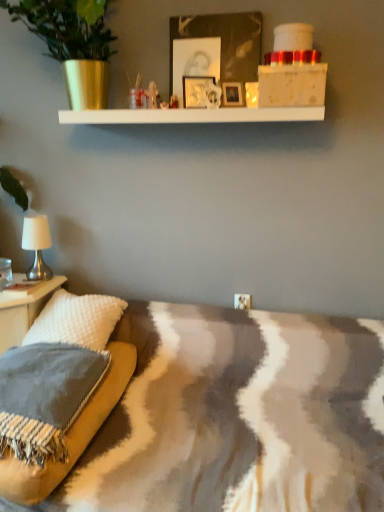
Describe the element at coordinates (45, 396) in the screenshot. I see `textured gray pillow at lower left` at that location.

Find the location of a particular element. white fabric lampshade at left is located at coordinates (37, 245).

The image size is (384, 512). Identify the location of textured gray pillow at lower left. (45, 396).

Is textured gray pillow at lower left positioned beyond the bounds of white fabric lampshade at left?

Yes, textured gray pillow at lower left is not within white fabric lampshade at left.

Find the location of a particular element. The height and width of the screenshot is (512, 384). pillow to the right of white fabric lampshade at left is located at coordinates (45, 396).

Between textured gray pillow at lower left and white fabric lampshade at left, which one has larger size?

With larger size is textured gray pillow at lower left.

From the image's perspective, which is below, textured gray pillow at lower left or white fabric lampshade at left?

textured gray pillow at lower left.

Considering the positions of objects metallic silver picture frame at upper center and textured gray pillow at lower left in the image provided, who is more to the left, metallic silver picture frame at upper center or textured gray pillow at lower left?

textured gray pillow at lower left.

This screenshot has height=512, width=384. In order to click on pillow that appears below the metallic silver picture frame at upper center (from a real-world perspective) in this screenshot , I will do [x=45, y=396].

In terms of width, does metallic silver picture frame at upper center look wider or thinner when compared to textured gray pillow at lower left?

In the image, metallic silver picture frame at upper center appears to be more narrow than textured gray pillow at lower left.

Is there a large distance between white textured pillow at left and textured gray pillow at lower left?

No, white textured pillow at left is in close proximity to textured gray pillow at lower left.

From a real-world perspective, is white textured pillow at left over textured gray pillow at lower left?

Yes, from a real-world perspective, white textured pillow at left is on top of textured gray pillow at lower left.

Does white textured pillow at left come in front of textured gray pillow at lower left?

No, the depth of white textured pillow at left is greater than that of textured gray pillow at lower left.

From the image's perspective, relative to textured gray pillow at lower left, is white textured pillow at left above or below?

Based on their image positions, white textured pillow at left is located above textured gray pillow at lower left.

Considering the positions of objects metallic silver picture frame at upper center and white fabric lampshade at left in the image provided, who is more to the right, metallic silver picture frame at upper center or white fabric lampshade at left?

From the viewer's perspective, metallic silver picture frame at upper center appears more on the right side.

Can you confirm if metallic silver picture frame at upper center is wider than white fabric lampshade at left?

In fact, metallic silver picture frame at upper center might be narrower than white fabric lampshade at left.

Considering the sizes of objects metallic silver picture frame at upper center and white fabric lampshade at left in the image provided, who is shorter, metallic silver picture frame at upper center or white fabric lampshade at left?

metallic silver picture frame at upper center is shorter.

Is textured gray pillow at lower left in front of or behind white textured pillow at left in the image?

Clearly, textured gray pillow at lower left is in front of white textured pillow at left.

Identify the location of throw pillow that is above the textured gray pillow at lower left (from the image's perspective). This screenshot has height=512, width=384. (77, 320).

From the image's perspective, which one is positioned lower, textured gray pillow at lower left or white textured pillow at left?

textured gray pillow at lower left is shown below in the image.

Could you tell me if textured gray pillow at lower left is facing white textured pillow at left?

No.

From a real-world perspective, who is located lower, white fabric lampshade at left or metallic silver picture frame at upper center?

white fabric lampshade at left.

Considering the relative positions of white fabric lampshade at left and metallic silver picture frame at upper center in the image provided, is white fabric lampshade at left to the left or to the right of metallic silver picture frame at upper center?

Clearly, white fabric lampshade at left is on the left of metallic silver picture frame at upper center in the image.

Is metallic silver picture frame at upper center at the back of white fabric lampshade at left?

No.

In the scene shown: Considering the sizes of objects white fabric lampshade at left and metallic silver picture frame at upper center in the image provided, who is bigger, white fabric lampshade at left or metallic silver picture frame at upper center?

Bigger between the two is white fabric lampshade at left.

From the image's perspective, is textured gray pillow at lower left over metallic silver picture frame at upper center?

Actually, textured gray pillow at lower left appears below metallic silver picture frame at upper center in the image.

Is the surface of textured gray pillow at lower left in direct contact with metallic silver picture frame at upper center?

No, textured gray pillow at lower left is not touching metallic silver picture frame at upper center.

Choose the correct answer: Is textured gray pillow at lower left inside metallic silver picture frame at upper center or outside it?

textured gray pillow at lower left is not inside metallic silver picture frame at upper center, it's outside.

Relative to metallic silver picture frame at upper center, is textured gray pillow at lower left in front or behind?

textured gray pillow at lower left is in front of metallic silver picture frame at upper center.

I want to click on pillow that is in front of the white fabric lampshade at left, so click(x=45, y=396).

Find the location of a particular element. picture frame above the textured gray pillow at lower left (from a real-world perspective) is located at coordinates (198, 91).

Looking at the image, which one is located closer to textured gray pillow at lower left, metallic silver picture frame at upper center or white fabric lampshade at left?

white fabric lampshade at left.

Considering their positions, is metallic silver picture frame at upper center positioned closer to white fabric lampshade at left than white textured pillow at left?

white textured pillow at left.

Considering their positions, is white textured pillow at left positioned closer to white fabric lampshade at left than metallic silver picture frame at upper center?

The object closer to white fabric lampshade at left is white textured pillow at left.

Based on their spatial positions, is white textured pillow at left or textured gray pillow at lower left closer to metallic silver picture frame at upper center?

Among the two, white textured pillow at left is located nearer to metallic silver picture frame at upper center.

From the image, which object appears to be nearer to white textured pillow at left, white fabric lampshade at left or textured gray pillow at lower left?

textured gray pillow at lower left lies closer to white textured pillow at left than the other object.

Considering their positions, is textured gray pillow at lower left positioned further to white textured pillow at left than metallic silver picture frame at upper center?

metallic silver picture frame at upper center is further to white textured pillow at left.

Looking at the image, which one is located further to metallic silver picture frame at upper center, white fabric lampshade at left or white textured pillow at left?

white textured pillow at left lies further to metallic silver picture frame at upper center than the other object.

When comparing their distances from textured gray pillow at lower left, does metallic silver picture frame at upper center or white textured pillow at left seem further?

metallic silver picture frame at upper center is further to textured gray pillow at lower left.

The height and width of the screenshot is (512, 384). Identify the location of throw pillow between metallic silver picture frame at upper center and textured gray pillow at lower left vertically. (77, 320).

You are a GUI agent. You are given a task and a screenshot of the screen. Output one action in this format:
    pyautogui.click(x=<x>, y=<y>)
    Task: Click on the table lamp between metallic silver picture frame at upper center and white textured pillow at left from top to bottom
    
    Given the screenshot: What is the action you would take?
    pyautogui.click(x=37, y=245)

Where is `throw pillow between textured gray pillow at lower left and white fabric lampshade at left in the front-back direction`? throw pillow between textured gray pillow at lower left and white fabric lampshade at left in the front-back direction is located at coordinates (77, 320).

Where is `table lamp between metallic silver picture frame at upper center and textured gray pillow at lower left in the vertical direction`? This screenshot has width=384, height=512. table lamp between metallic silver picture frame at upper center and textured gray pillow at lower left in the vertical direction is located at coordinates (37, 245).